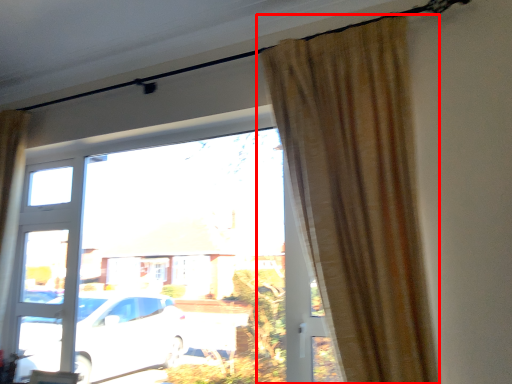
Question: From the image, what is the correct spatial relationship of curtain (annotated by the red box) in relation to window?

Choices:
 (A) right
 (B) left

Answer: (A)